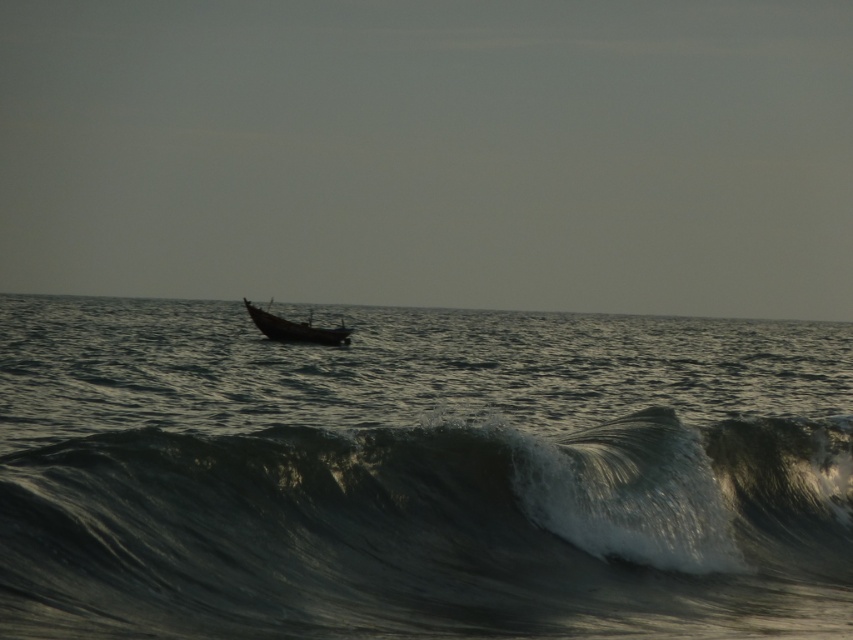
You are standing at the point marked as point (712, 486). A boat is anchored 57.11 feet away from you. In which direction should you walk to reach the boat?

The boat is 57.11 feet away from point (712, 486), but the exact direction isn

You are standing on a cliff overlooking the ocean and see two points in the scene. The first point is at coordinates point [509,627] and the second is at point [281,321]. Which point is closer to you?

Point [509,627] is closer to the viewer than point [281,321].

You are standing on the shore and see the shiny dark gray wave at center and the dark matte boat at center. Which object is closer to the horizon?

The dark matte boat at center is closer to the horizon because the shiny dark gray wave at center is located below it, meaning the boat is positioned higher up in the image and thus nearer to the horizon line.